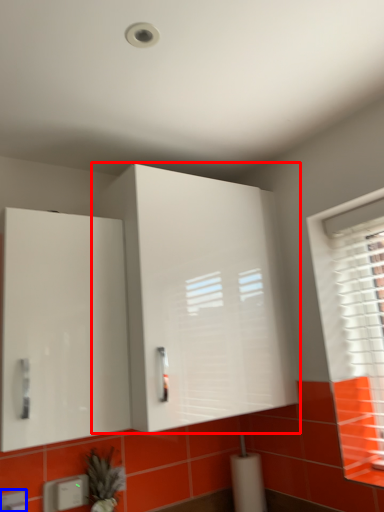
Question: Which point is closer to the camera, cabinetry (highlighted by a red box) or electric outlet (highlighted by a blue box)?

Choices:
 (A) cabinetry
 (B) electric outlet

Answer: (A)